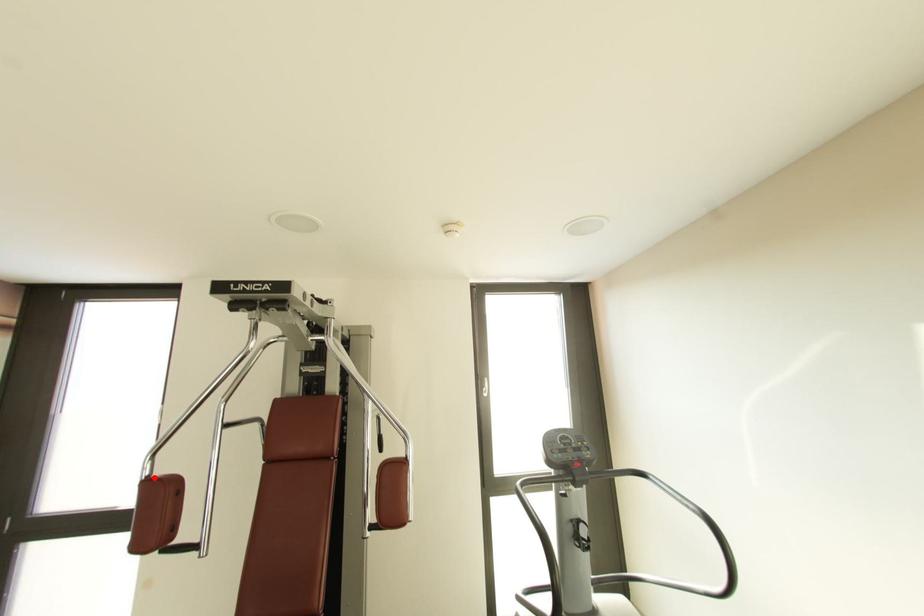
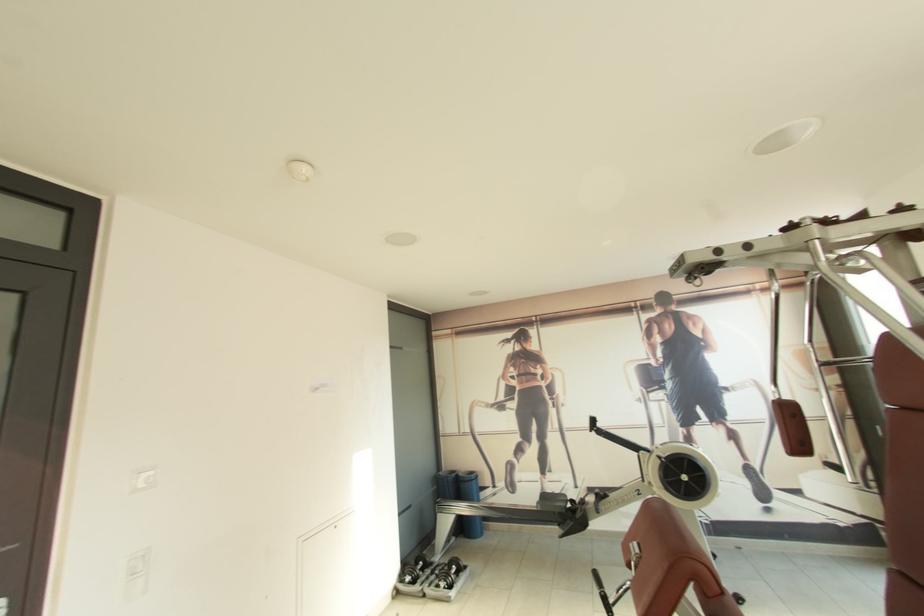
The point at the highlighted location is marked in the first image. Where is the corresponding point in the second image?

(784, 400)